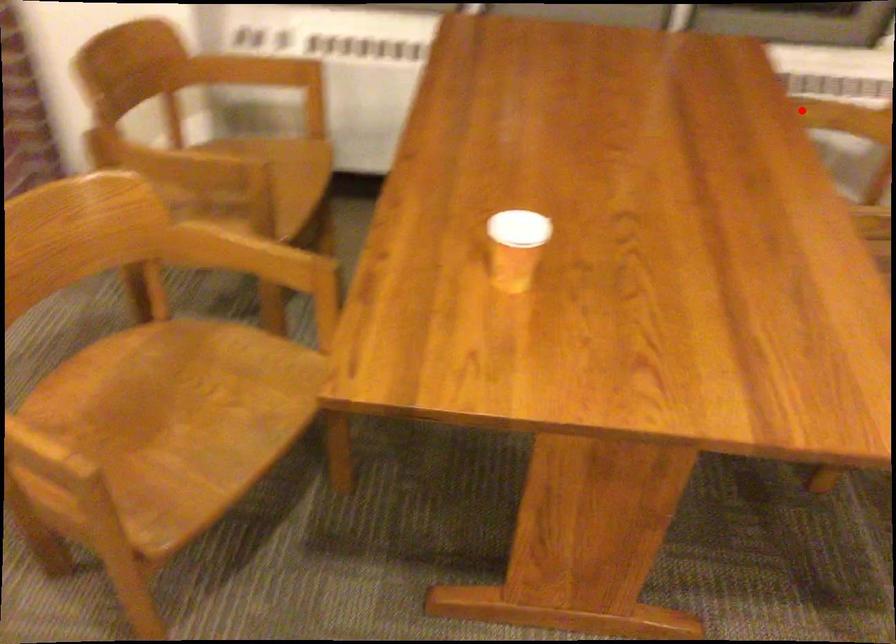
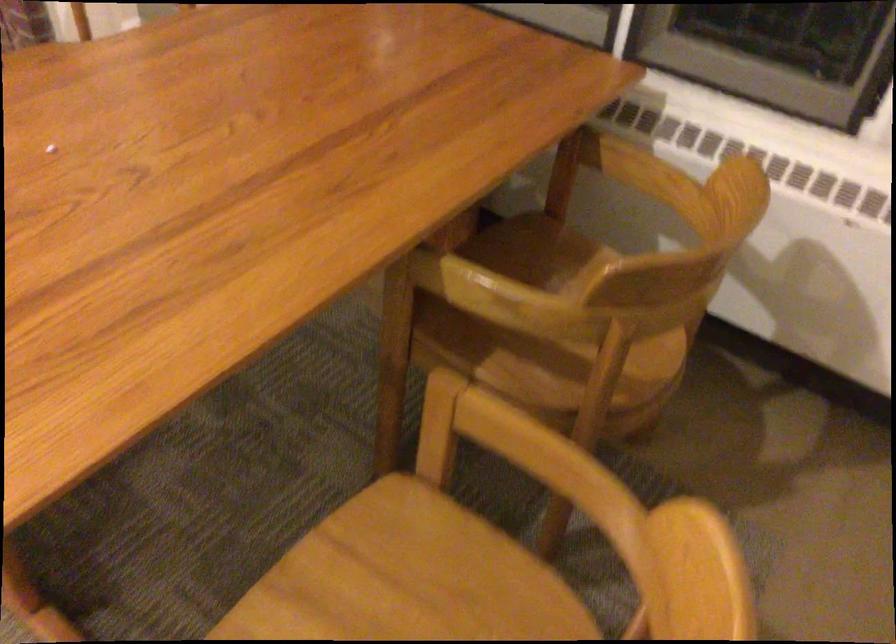
Question: I am providing you with two images of the same scene from different viewpoints. In image1, a red point is highlighted. Considering the same 3D point in image2, which of the following is correct?

Choices:
 (A) It is closer
 (B) It is farther

Answer: (A)